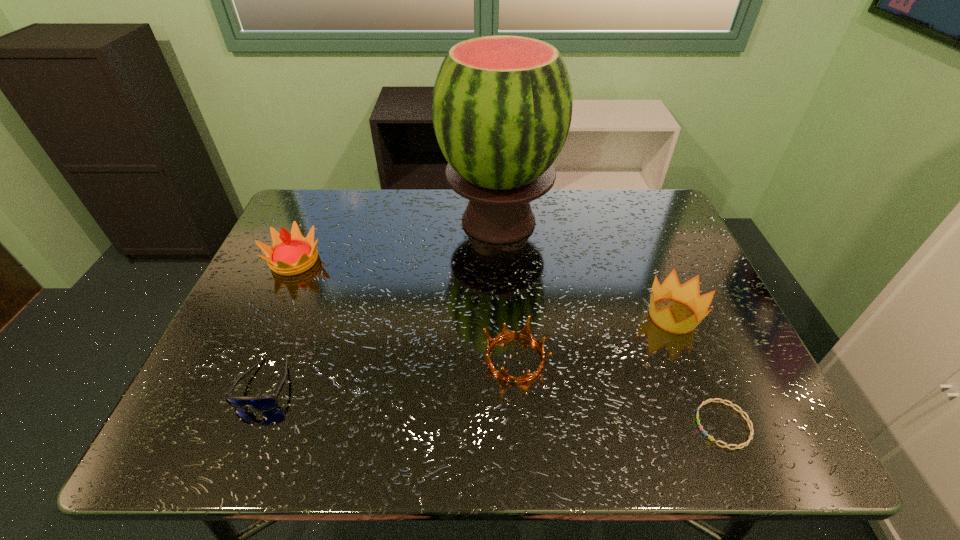
This screenshot has height=540, width=960. Find the location of `empty space that is in between the second shortest object and the shortest object`. empty space that is in between the second shortest object and the shortest object is located at coordinates (494, 405).

Locate an element on the screen. The width and height of the screenshot is (960, 540). vacant area that lies between the shortest object and the fifth shortest object is located at coordinates (509, 342).

I want to click on vacant area that lies between the tallest object and the shortest object, so click(611, 323).

Where is `unoccupied position between the shortest object and the sunglasses`? unoccupied position between the shortest object and the sunglasses is located at coordinates (494, 405).

Find the location of a particular element. free space between the shortest crown and the rightmost crown is located at coordinates 594,337.

This screenshot has width=960, height=540. I want to click on free space between the second crown from right to left and the sunglasses, so click(x=390, y=372).

In order to click on unoccupied area between the second tallest crown and the tallest crown in this screenshot , I will do `click(484, 288)`.

I want to click on unoccupied position between the farthest crown and the tallest object, so click(396, 241).

At what (x,y) coordinates should I click in order to perform the action: click on free space between the shortest object and the second crown from left to right. Please return your answer as a coordinate pair (x, y). The image size is (960, 540). Looking at the image, I should click on (619, 392).

This screenshot has width=960, height=540. In order to click on vacant space that is in between the shortest object and the rightmost crown in this screenshot , I will do `click(698, 370)`.